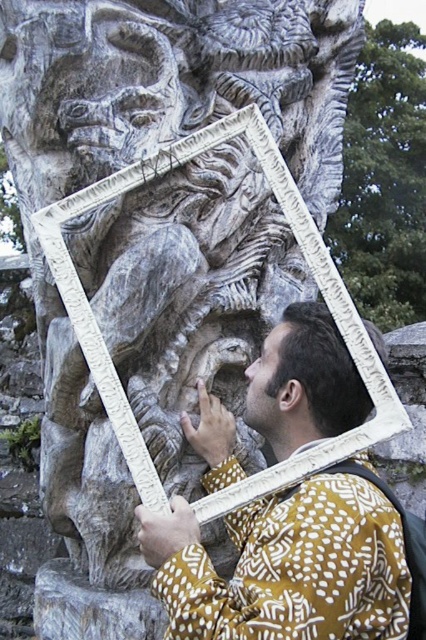
You are a photographer trying to capture a clear shot of the matte brown hair at lower right without the green leafy tree at upper right blocking the view. Based on the scene description, can you position yourself in a way that the tree doesn

The green leafy tree at upper right is wider than the matte brown hair at lower right. To avoid the tree blocking the view of the matte brown hair at lower right, position yourself so the narrower matte brown hair at lower right is framed outside the tree

You are an artist trying to sketch the scene. You notice two elements in the image that are important for your drawing. Which of the two elements, the yellow patterned shirt at center or the matte brown hair at lower right, should you draw first if you want to follow the size from largest to smallest?

The yellow patterned shirt at center should be drawn first because it is larger than the matte brown hair at lower right.

You are a photographer trying to capture a clear shot of the sculpture without any obstructions. You notice the yellow patterned shirt at center and the matte brown hair at lower right in your frame. Which object should you adjust to ensure the sculpture is fully visible?

The yellow patterned shirt at center has a greater height compared to matte brown hair at lower right, so you should adjust the yellow patterned shirt at center to ensure the sculpture is fully visible.